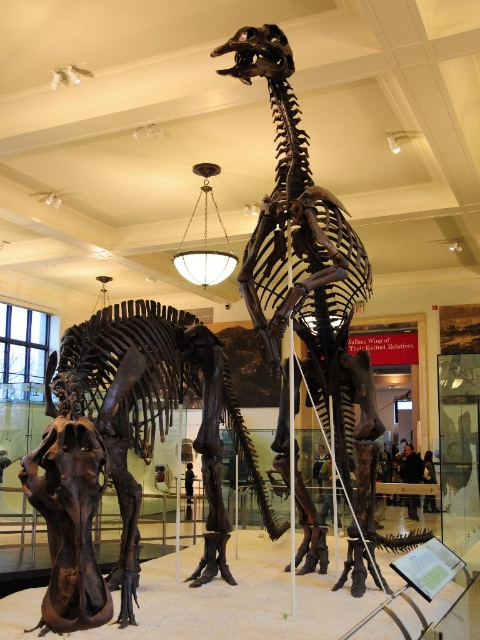
You are standing in the museum and want to take a photo of both point (169, 321) and point (348, 256). Which point will appear closer to the camera in your photo?

Point (169, 321) is further to the camera than point (348, 256), so in the photo, point (169, 321) will appear closer to the camera than point (348, 256).

You are a museum visitor standing at the entrance of the gallery. You want to take a photo of the shiny brown dinosaur at center without any obstructions. Based on its position, can you estimate if it will be fully visible from your current spot?

The shiny brown dinosaur at center is located at point coordinates that suggest it is positioned in a central area of the gallery. Since the skeletons are mounted on a raised platform and the gallery has a spacious layout with high ceilings, it is likely that the shiny brown dinosaur at center will be fully visible from the entrance without obstructions.

What is the significance of the point located at coordinates (x=126, y=449) in the museum exhibit?

The point at coordinates (x=126, y=449) marks the location of the shiny brown dinosaur at center in the museum exhibit.